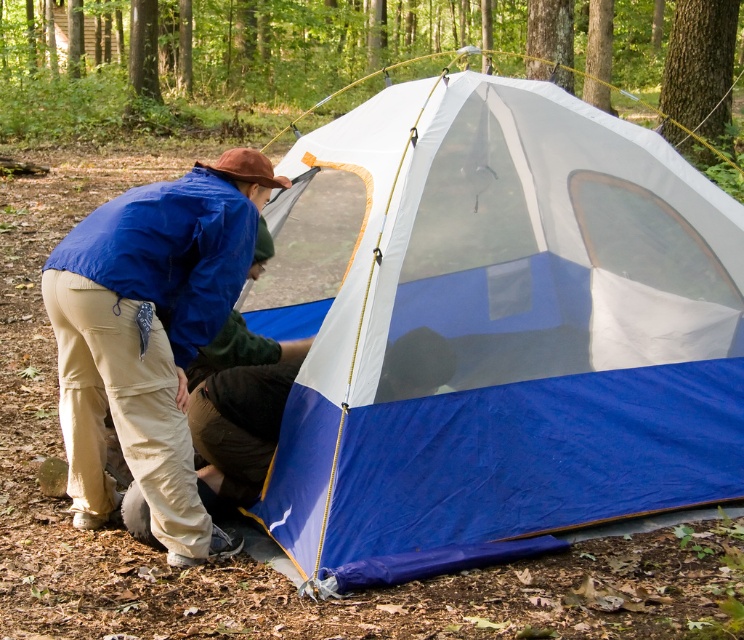
Does blue tarpaulin tent at center come behind blue fabric jacket at lower left?

No, blue tarpaulin tent at center is in front of blue fabric jacket at lower left.

Does blue tarpaulin tent at center appear over blue fabric jacket at lower left?

Yes.

This screenshot has width=744, height=640. What are the coordinates of `blue tarpaulin tent at center` in the screenshot? It's located at (506, 333).

Identify the location of blue tarpaulin tent at center. (506, 333).